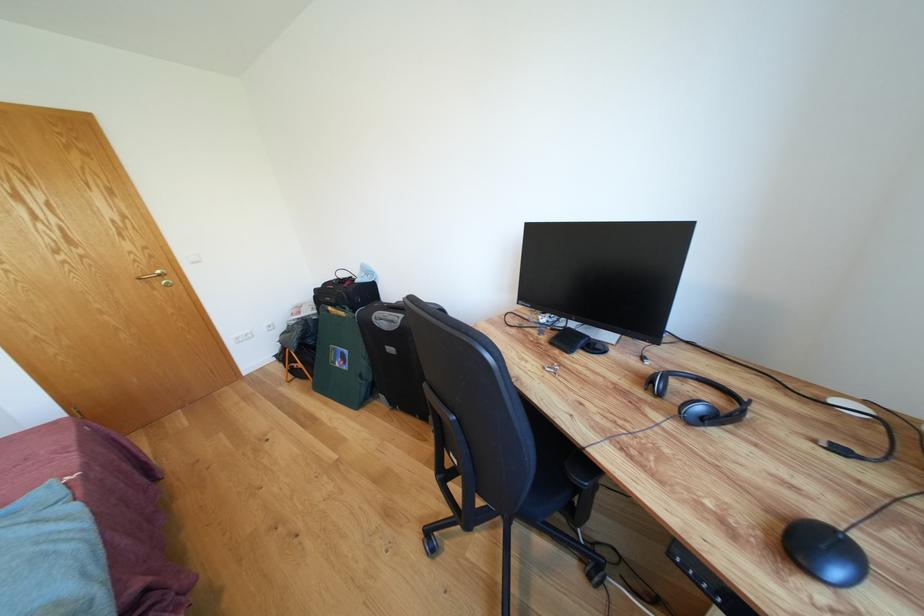
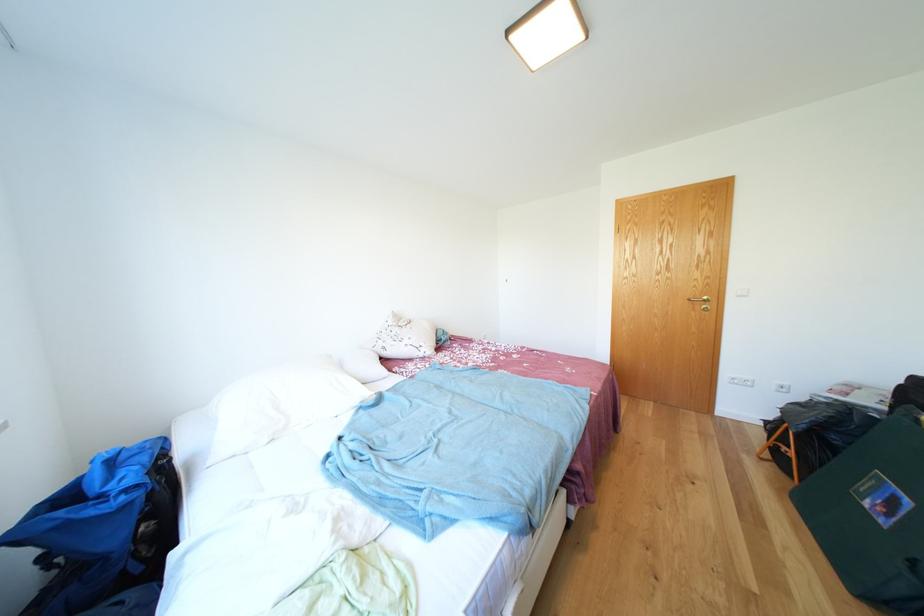
The images are taken continuously from a first-person perspective. In which direction is your viewpoint rotating?

The rotation direction of the camera is left-down.